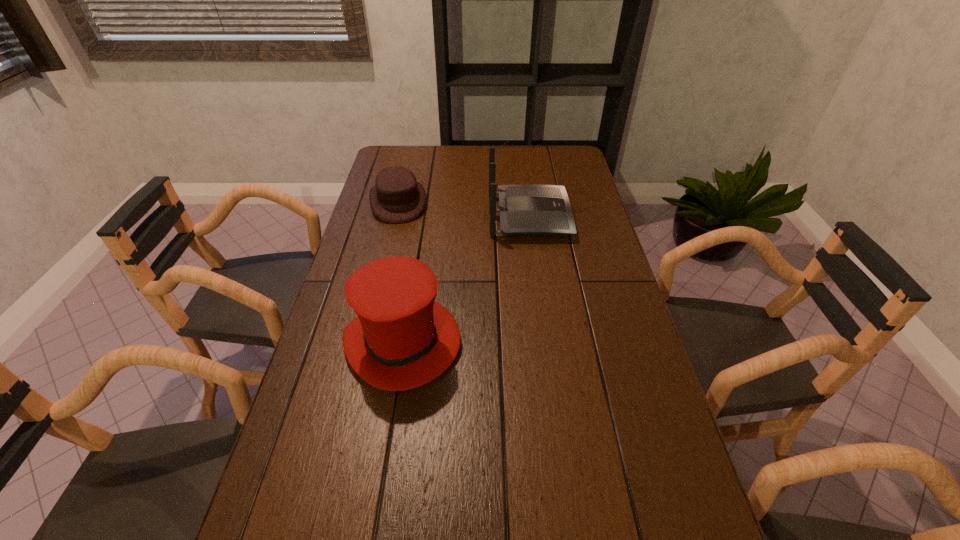
This screenshot has width=960, height=540. I want to click on router, so click(527, 209).

This screenshot has width=960, height=540. Identify the location of the nearest object. (401, 339).

I want to click on the taller hat, so click(x=401, y=339).

Where is `the shortest object`? The image size is (960, 540). the shortest object is located at coordinates (396, 198).

Locate an element on the screen. The height and width of the screenshot is (540, 960). the shorter hat is located at coordinates (396, 198).

Identify the location of vacant space situated 0.090m on the front-facing side of the router. (595, 216).

At what (x,y) coordinates should I click in order to perform the action: click on free space located 0.160m on the right of the taller hat. Please return your answer as a coordinate pair (x, y). The height and width of the screenshot is (540, 960). Looking at the image, I should click on (525, 342).

You are a GUI agent. You are given a task and a screenshot of the screen. Output one action in this format:
    pyautogui.click(x=<x>, y=<y>)
    Task: Click on the vacant area situated on the front of the shorter hat
    This screenshot has height=540, width=960.
    Given the screenshot: What is the action you would take?
    pyautogui.click(x=381, y=273)

Locate an element on the screen. The image size is (960, 540). object situated at the right edge is located at coordinates (527, 209).

This screenshot has width=960, height=540. I want to click on vacant space at the far edge, so [506, 163].